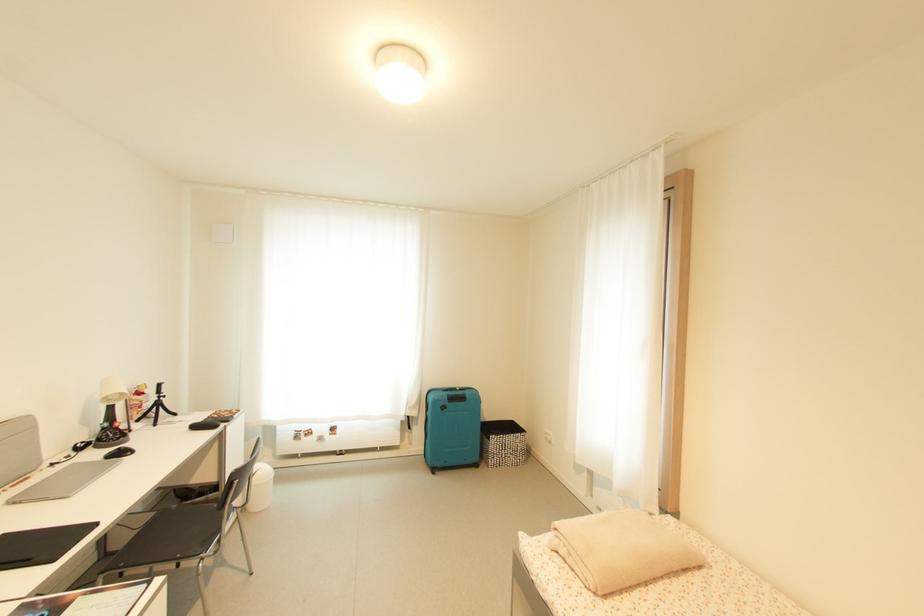
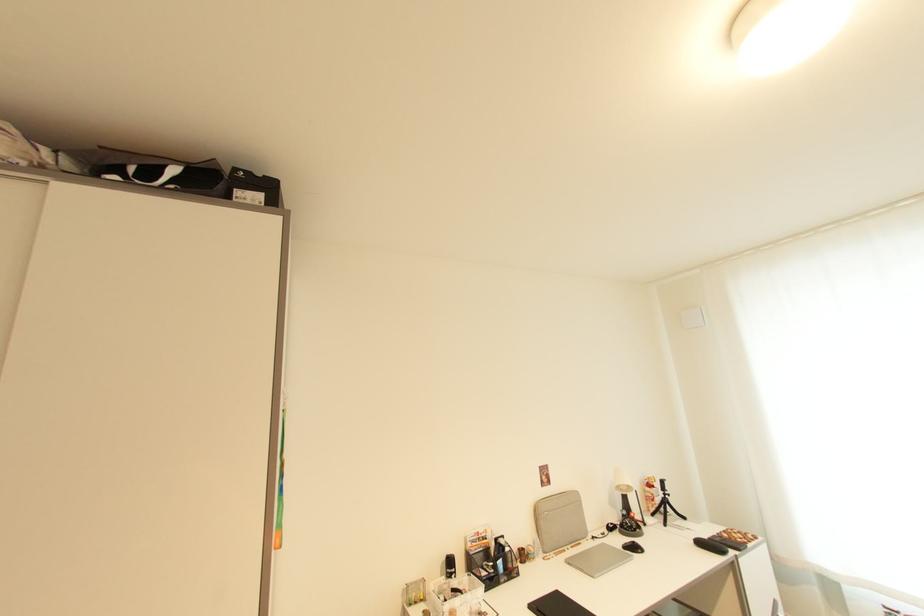
The point at (127, 455) is marked in the first image. Where is the corresponding point in the second image?

(639, 549)